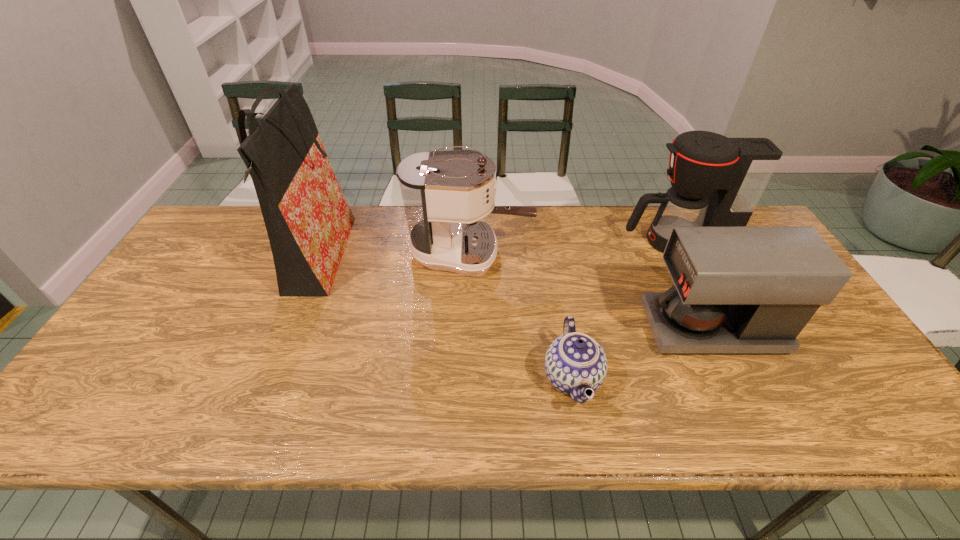
Find the location of `the tallest object`. the tallest object is located at coordinates (308, 221).

I want to click on the leftmost object, so click(308, 221).

Where is `the leftmost coffee maker`? The height and width of the screenshot is (540, 960). the leftmost coffee maker is located at coordinates (446, 194).

You are a GUI agent. You are given a task and a screenshot of the screen. Output one action in this format:
    pyautogui.click(x=<x>, y=<y>)
    Task: Click on the shortest coffee maker
    This screenshot has height=540, width=960.
    Given the screenshot: What is the action you would take?
    pyautogui.click(x=737, y=289)

Where is `the second shortest object`? Image resolution: width=960 pixels, height=540 pixels. the second shortest object is located at coordinates (737, 289).

This screenshot has width=960, height=540. Find the location of `chinaware`. chinaware is located at coordinates (574, 362).

Where is `vacant space positioned 0.100m on the front side of the leftmost object`? Image resolution: width=960 pixels, height=540 pixels. vacant space positioned 0.100m on the front side of the leftmost object is located at coordinates (382, 259).

Locate an element on the screen. vacant space located 0.340m on the front-facing side of the leftmost coffee maker is located at coordinates (642, 253).

Locate an element on the screen. free spot located on the carafe side of the second shortest object is located at coordinates (610, 328).

The height and width of the screenshot is (540, 960). In order to click on vacant region located 0.200m on the carafe side of the second shortest object in this screenshot , I will do `click(571, 328)`.